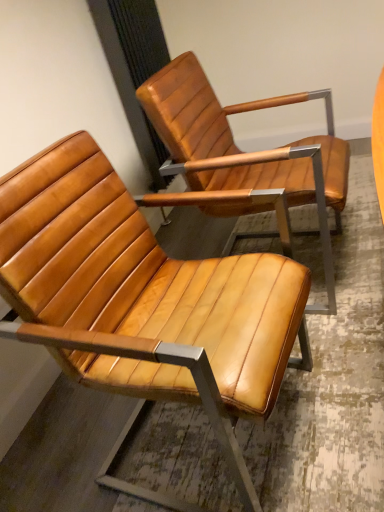
The height and width of the screenshot is (512, 384). Find the location of `matte leather chair at center, the second chair from the back`. matte leather chair at center, the second chair from the back is located at coordinates (142, 297).

Describe the element at coordinates (142, 297) in the screenshot. I see `matte leather chair at center, the second chair from the back` at that location.

The height and width of the screenshot is (512, 384). What do you see at coordinates (244, 159) in the screenshot?
I see `matte brown leather chair at upper right, the second chair positioned from the front` at bounding box center [244, 159].

This screenshot has width=384, height=512. Find the location of `matte brown leather chair at upper right, the 1th chair in the back-to-front sequence`. matte brown leather chair at upper right, the 1th chair in the back-to-front sequence is located at coordinates (244, 159).

Measure the distance between matte brown leather chair at upper right, the 1th chair in the back-to-front sequence, and camera.

3.45 feet.

How much space does matte brown leather chair at upper right, the second chair positioned from the front, occupy horizontally?

matte brown leather chair at upper right, the second chair positioned from the front, is 25.65 inches in width.

This screenshot has width=384, height=512. Identify the location of matte leather chair at center, arranged as the first chair when viewed from the front. (142, 297).

From the picture: Is matte brown leather chair at upper right, the 1th chair in the back-to-front sequence, at the right side of matte leather chair at center, arranged as the first chair when viewed from the front?

Correct, you'll find matte brown leather chair at upper right, the 1th chair in the back-to-front sequence, to the right of matte leather chair at center, arranged as the first chair when viewed from the front.

Between matte brown leather chair at upper right, the 1th chair in the back-to-front sequence, and matte leather chair at center, arranged as the first chair when viewed from the front, which one is positioned in front?

matte leather chair at center, arranged as the first chair when viewed from the front, is more forward.

Considering the points (336, 201) and (197, 386), which point is in front, point (336, 201) or point (197, 386)?

Point (197, 386)

From the image's perspective, is matte brown leather chair at upper right, the 1th chair in the back-to-front sequence, below matte leather chair at center, the second chair from the back?

Incorrect, from the image's perspective, matte brown leather chair at upper right, the 1th chair in the back-to-front sequence, is higher than matte leather chair at center, the second chair from the back.

From a real-world perspective, is matte brown leather chair at upper right, the 1th chair in the back-to-front sequence, located higher than matte leather chair at center, the second chair from the back?

Correct, in the physical world, matte brown leather chair at upper right, the 1th chair in the back-to-front sequence, is higher than matte leather chair at center, the second chair from the back.

Can you confirm if matte brown leather chair at upper right, the second chair positioned from the front, is thinner than matte leather chair at center, arranged as the first chair when viewed from the front?

No.

Based on the photo, considering the sizes of matte brown leather chair at upper right, the second chair positioned from the front, and matte leather chair at center, arranged as the first chair when viewed from the front, in the image, is matte brown leather chair at upper right, the second chair positioned from the front, taller or shorter than matte leather chair at center, arranged as the first chair when viewed from the front,?

matte brown leather chair at upper right, the second chair positioned from the front, is taller than matte leather chair at center, arranged as the first chair when viewed from the front.

Who is smaller, matte brown leather chair at upper right, the 1th chair in the back-to-front sequence, or matte leather chair at center, the second chair from the back?

matte leather chair at center, the second chair from the back.

From the picture: Which is correct: matte brown leather chair at upper right, the 1th chair in the back-to-front sequence, is inside matte leather chair at center, the second chair from the back, or outside of it?

matte brown leather chair at upper right, the 1th chair in the back-to-front sequence, is not enclosed by matte leather chair at center, the second chair from the back.

Is there a large distance between matte brown leather chair at upper right, the second chair positioned from the front, and matte leather chair at center, arranged as the first chair when viewed from the front?

No, there isn't a large distance between matte brown leather chair at upper right, the second chair positioned from the front, and matte leather chair at center, arranged as the first chair when viewed from the front.

Is matte brown leather chair at upper right, the second chair positioned from the front, facing away from matte leather chair at center, the second chair from the back?

No, matte brown leather chair at upper right, the second chair positioned from the front,'s orientation is not away from matte leather chair at center, the second chair from the back.

What's the angular difference between matte brown leather chair at upper right, the 1th chair in the back-to-front sequence, and matte leather chair at center, arranged as the first chair when viewed from the front,'s facing directions?

There is a 4.02-degree angle between the facing directions of matte brown leather chair at upper right, the 1th chair in the back-to-front sequence, and matte leather chair at center, arranged as the first chair when viewed from the front.

This screenshot has width=384, height=512. Find the location of `chair on the right side of matte leather chair at center, arranged as the first chair when viewed from the front`. chair on the right side of matte leather chair at center, arranged as the first chair when viewed from the front is located at coordinates (244, 159).

Which object is positioned more to the left, matte leather chair at center, the second chair from the back, or matte brown leather chair at upper right, the 1th chair in the back-to-front sequence?

matte leather chair at center, the second chair from the back.

Does matte leather chair at center, the second chair from the back, lie in front of matte brown leather chair at upper right, the 1th chair in the back-to-front sequence?

That is True.

Which point is more forward, [93,292] or [190,148]?

Positioned in front is point [93,292].

From the image's perspective, is matte leather chair at center, arranged as the first chair when viewed from the front, over matte brown leather chair at upper right, the 1th chair in the back-to-front sequence?

No, from the image's perspective, matte leather chair at center, arranged as the first chair when viewed from the front, is not above matte brown leather chair at upper right, the 1th chair in the back-to-front sequence.

From a real-world perspective, is matte leather chair at center, arranged as the first chair when viewed from the front, physically above matte brown leather chair at upper right, the second chair positioned from the front?

Actually, matte leather chair at center, arranged as the first chair when viewed from the front, is physically below matte brown leather chair at upper right, the second chair positioned from the front, in the real world.

Between matte leather chair at center, arranged as the first chair when viewed from the front, and matte brown leather chair at upper right, the 1th chair in the back-to-front sequence, which one has larger width?

With larger width is matte brown leather chair at upper right, the 1th chair in the back-to-front sequence.

In the scene shown: Does matte leather chair at center, the second chair from the back, have a greater height compared to matte brown leather chair at upper right, the 1th chair in the back-to-front sequence?

No.

Considering the relative sizes of matte leather chair at center, arranged as the first chair when viewed from the front, and matte brown leather chair at upper right, the 1th chair in the back-to-front sequence, in the image provided, is matte leather chair at center, arranged as the first chair when viewed from the front, smaller than matte brown leather chair at upper right, the 1th chair in the back-to-front sequence,?

Yes, matte leather chair at center, arranged as the first chair when viewed from the front, is smaller than matte brown leather chair at upper right, the 1th chair in the back-to-front sequence.

Would you say matte leather chair at center, arranged as the first chair when viewed from the front, is inside or outside matte brown leather chair at upper right, the 1th chair in the back-to-front sequence?

matte leather chair at center, arranged as the first chair when viewed from the front, is outside matte brown leather chair at upper right, the 1th chair in the back-to-front sequence.

Is matte leather chair at center, the second chair from the back, positioned far away from matte brown leather chair at upper right, the second chair positioned from the front?

matte leather chair at center, the second chair from the back, is near matte brown leather chair at upper right, the second chair positioned from the front, not far away.

Is matte brown leather chair at upper right, the 1th chair in the back-to-front sequence, at the back of matte leather chair at center, the second chair from the back?

No, matte leather chair at center, the second chair from the back, is not facing the opposite direction of matte brown leather chair at upper right, the 1th chair in the back-to-front sequence.

Image resolution: width=384 pixels, height=512 pixels. What are the coordinates of `chair below the matte brown leather chair at upper right, the second chair positioned from the front (from a real-world perspective)` in the screenshot? It's located at (142, 297).

Identify the location of chair above the matte leather chair at center, arranged as the first chair when viewed from the front (from the image's perspective). (244, 159).

The image size is (384, 512). I want to click on chair that is below the matte brown leather chair at upper right, the 1th chair in the back-to-front sequence (from the image's perspective), so click(142, 297).